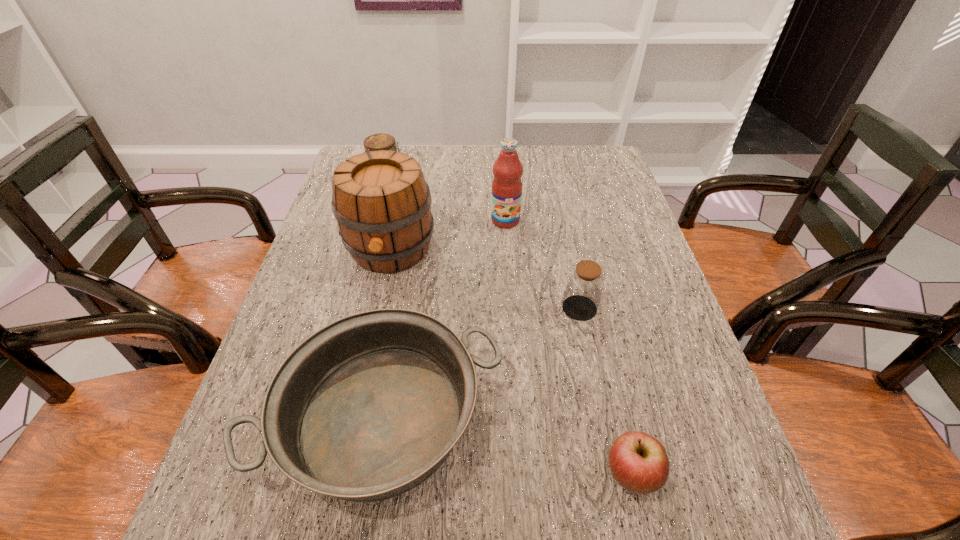
The image size is (960, 540). I want to click on fruit juice, so click(x=506, y=196).

Where is `cider`? This screenshot has height=540, width=960. cider is located at coordinates (382, 204).

The width and height of the screenshot is (960, 540). Find the location of `the left jar`. the left jar is located at coordinates (381, 141).

Image resolution: width=960 pixels, height=540 pixels. In order to click on the farthest object in this screenshot , I will do `click(381, 141)`.

I want to click on the fourth farthest object, so click(585, 283).

Locate an element on the screen. Image resolution: width=960 pixels, height=540 pixels. the nearer jar is located at coordinates (585, 283).

Where is `pan`? This screenshot has width=960, height=540. pan is located at coordinates (365, 409).

Locate an element on the screen. The height and width of the screenshot is (540, 960). apple is located at coordinates (639, 463).

Locate an element on the screen. This screenshot has width=960, height=540. free space located on the front label of the fruit juice is located at coordinates (510, 292).

The image size is (960, 540). I want to click on vacant area situated 0.110m on the side of the cider where the spigot is located, so pyautogui.click(x=376, y=318).